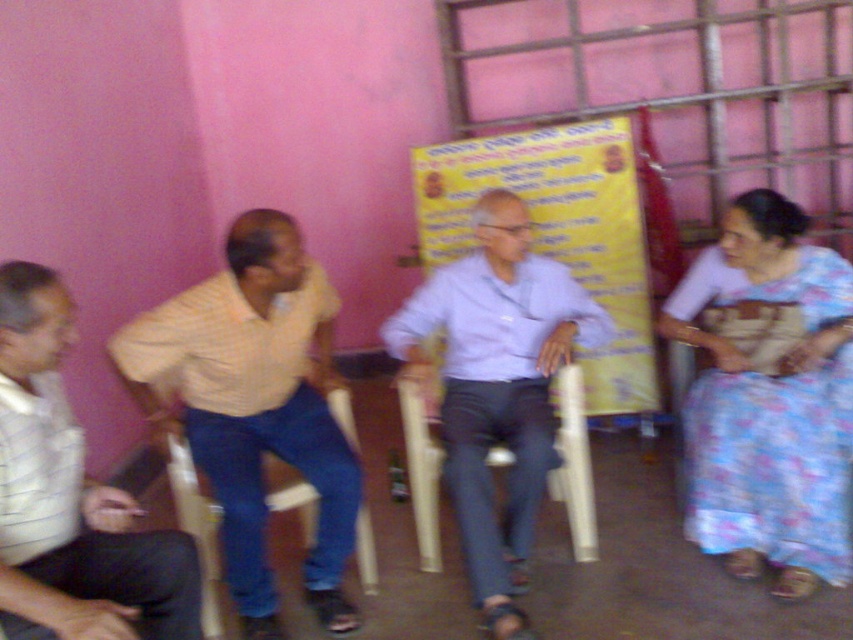
Question: Is yellow paper at center behind wooden at center?

Choices:
 (A) no
 (B) yes

Answer: (B)

Question: Is light yellow shirt at left positioned at the back of yellow paper at center?

Choices:
 (A) no
 (B) yes

Answer: (A)

Question: Is white striped shirt at left to the right of yellow paper at center from the viewer's perspective?

Choices:
 (A) yes
 (B) no

Answer: (B)

Question: Which object is farther from the camera taking this photo?

Choices:
 (A) light yellow shirt at left
 (B) light blue shirt at center
 (C) floral fabric saree at right
 (D) white striped shirt at left

Answer: (C)

Question: Based on their relative distances, which object is farther from the blue fabric chair at center?

Choices:
 (A) light blue shirt at center
 (B) floral fabric saree at right
 (C) yellow paper at center

Answer: (C)

Question: Estimate the real-world distances between objects in this image. Which object is closer to the wooden at center?

Choices:
 (A) white striped shirt at left
 (B) yellow paper at center
 (C) light blue shirt at center
 (D) light yellow shirt at left

Answer: (C)